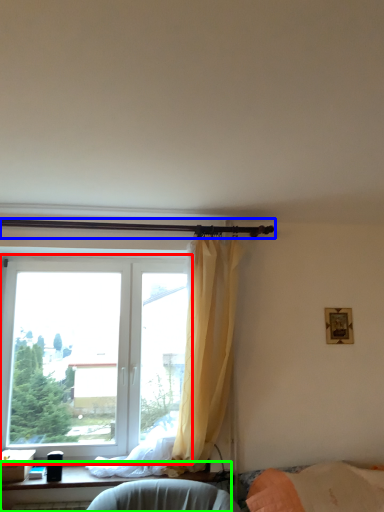
Question: Which object is the farthest from window (highlighted by a red box)? Choose among these: beam (highlighted by a blue box) or furniture (highlighted by a green box).

Choices:
 (A) beam
 (B) furniture

Answer: (A)